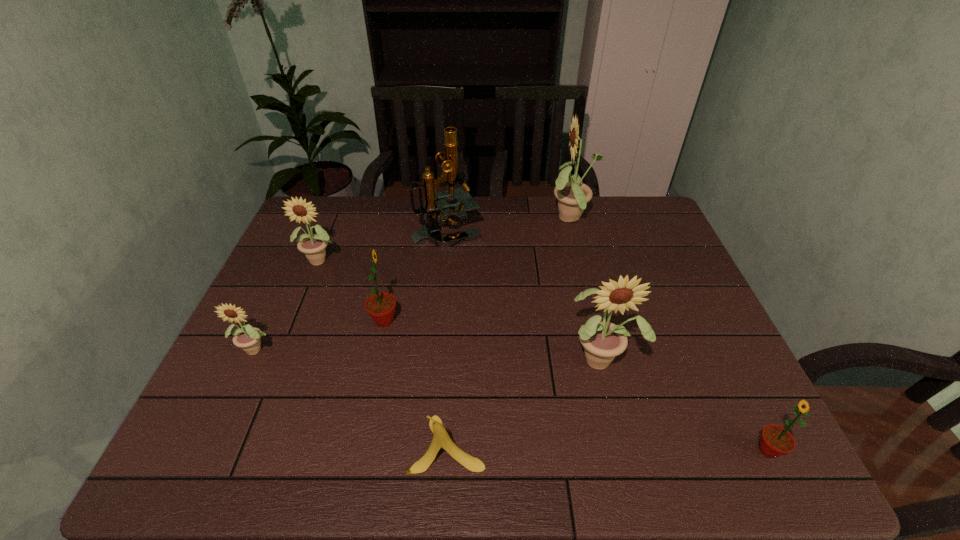
You are a GUI agent. You are given a task and a screenshot of the screen. Output one action in this format:
    pyautogui.click(x=<x>, y=<y>)
    Task: Click on the object that is at the near right corner
    Image resolution: width=960 pixels, height=540 pixels.
    Given the screenshot: What is the action you would take?
    pyautogui.click(x=775, y=441)

The height and width of the screenshot is (540, 960). What are the coordinates of `vacant space at the far edge` in the screenshot? It's located at (492, 231).

At what (x,y) coordinates should I click in order to perform the action: click on vacant space at the left edge. Please return your answer as a coordinate pair (x, y). Looking at the image, I should click on (285, 266).

Where is `vacant space at the right edge`? The image size is (960, 540). vacant space at the right edge is located at coordinates coord(681,261).

I want to click on blank space at the far left corner of the desktop, so click(315, 218).

Find the location of a particular element. The image size is (960, 540). vacant space at the near left corner of the desktop is located at coordinates (232, 475).

The image size is (960, 540). I want to click on vacant area at the far right corner of the desktop, so click(x=657, y=212).

Where is `vacant area at the near right corner`? This screenshot has height=540, width=960. vacant area at the near right corner is located at coordinates (702, 449).

Where is `empty space between the farthest sunflower and the smallest yellow sunflower`? Image resolution: width=960 pixels, height=540 pixels. empty space between the farthest sunflower and the smallest yellow sunflower is located at coordinates (415, 284).

Locate an element on the screen. vacant space in between the sixth shortest object and the biggest yellow sunflower is located at coordinates (587, 289).